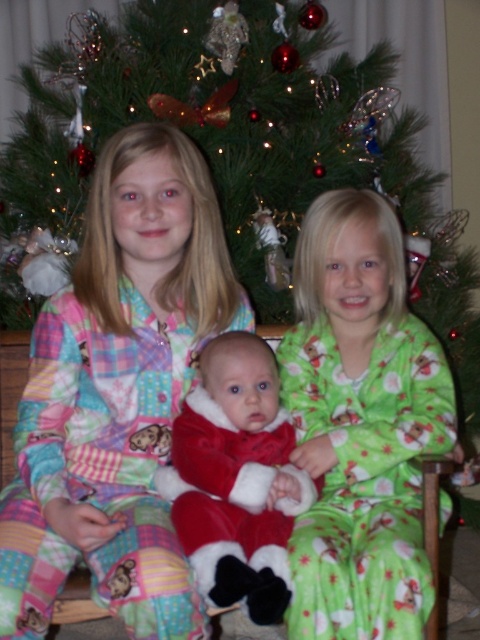
Question: Which point is closer to the camera taking this photo?

Choices:
 (A) 367,477
 (B) 230,371

Answer: (B)

Question: Which object is farther from the camera taking this photo?

Choices:
 (A) velvet red santa suit at center
 (B) green flannel pajamas at center
 (C) patchwork pajamas at center

Answer: (B)

Question: Among these objects, which one is farthest from the camera?

Choices:
 (A) velvet red santa suit at center
 (B) green flannel pajamas at center

Answer: (B)

Question: Is patchwork pajamas at center behind green flannel pajamas at center?

Choices:
 (A) yes
 (B) no

Answer: (B)

Question: Observing the image, what is the correct spatial positioning of patchwork pajamas at center in reference to green flannel pajamas at center?

Choices:
 (A) left
 (B) right

Answer: (A)

Question: Does green flannel pajamas at center appear under velvet red santa suit at center?

Choices:
 (A) yes
 (B) no

Answer: (B)